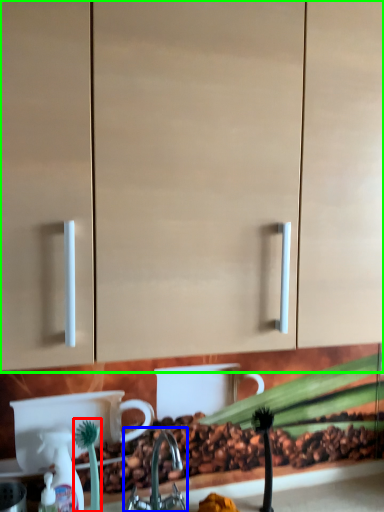
Question: Which object is positioned closest to plant (highlighted by a red box)? Select from tap (highlighted by a blue box) and cabinetry (highlighted by a green box).

Choices:
 (A) tap
 (B) cabinetry

Answer: (A)